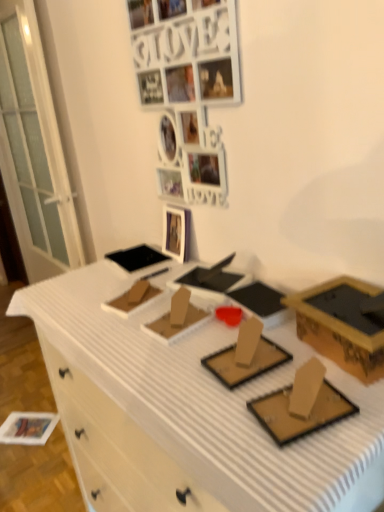
Locate an element on the screen. empty space that is ontop of white cardboard desk at center (from a real-world perspective) is located at coordinates (162, 312).